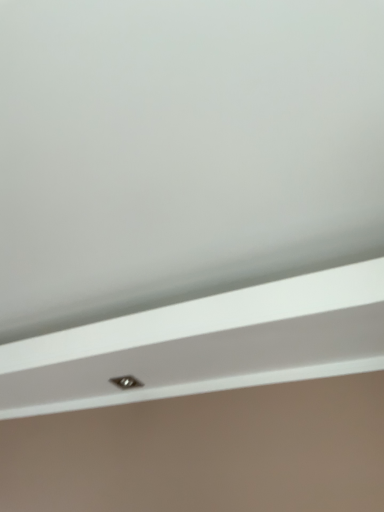
What do you see at coordinates (205, 344) in the screenshot? I see `metallic silver drawer at center` at bounding box center [205, 344].

Find the location of a particular element. Image resolution: width=384 pixels, height=512 pixels. metallic silver drawer at center is located at coordinates (205, 344).

Measure the distance between point (207, 384) and camera.

3.39 feet.

This screenshot has width=384, height=512. Find the location of `metallic silver drawer at center`. metallic silver drawer at center is located at coordinates (205, 344).